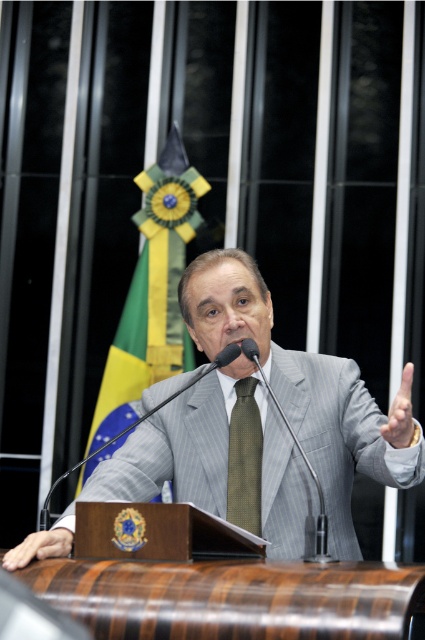
You are an event organizer and need to place a name tag on the podium for the speaker wearing the gray striped suit at center. Where should you position the name tag relative to the speaker?

The gray striped suit at center is located at point 0.680 on the x axis and 0.800 on the y axis, so you should position the name tag near the speaker at those coordinates.

You are an event organizer who needs to ensure the speaker is visible to the audience. The gray striped suit at center and the green fabric flag at center are both in the central area. Which one is closer to the front of the stage?

The gray striped suit at center is positioned under the green fabric flag at center, meaning the gray striped suit is closer to the front of the stage.